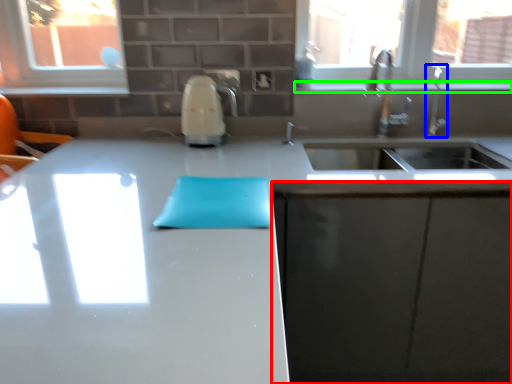
Question: Based on their relative distances, which object is nearer to cabinetry (highlighted by a red box)? Choose from faucet (highlighted by a blue box) and window sill (highlighted by a green box).

Choices:
 (A) faucet
 (B) window sill

Answer: (A)